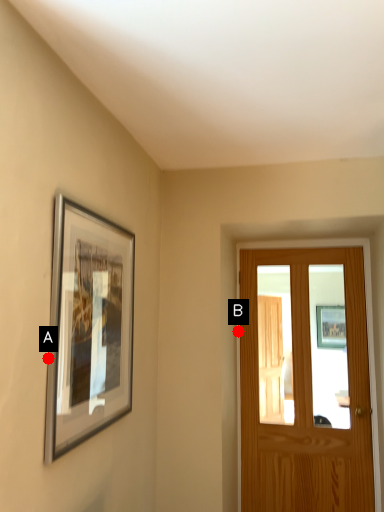
Question: Two points are circled on the image, labeled by A and B beside each circle. Which of the following is the closest to the observer?

Choices:
 (A) A is closer
 (B) B is closer

Answer: (A)